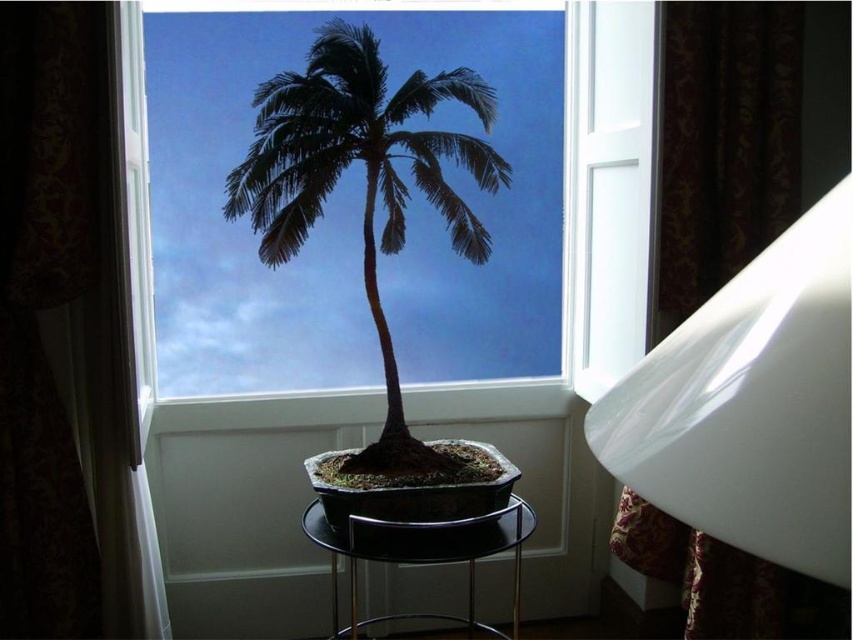
This screenshot has width=853, height=640. What do you see at coordinates (421, 556) in the screenshot?
I see `black glass stool at center` at bounding box center [421, 556].

Which is in front, point (334, 554) or point (352, 480)?

Point (352, 480)

Between point (471, 524) and point (450, 488), which one is positioned behind?

Positioned behind is point (471, 524).

Locate an element on the screen. The width and height of the screenshot is (853, 640). black glass stool at center is located at coordinates coord(421,556).

Between silky black palm tree at center and black glass stool at center, which one appears on the right side from the viewer's perspective?

From the viewer's perspective, black glass stool at center appears more on the right side.

Which is below, silky black palm tree at center or black glass stool at center?

black glass stool at center is lower down.

Is point (322, 58) positioned in front of point (318, 528)?

Yes, point (322, 58) is closer to viewer.

Find the location of `silky black palm tree at center`. silky black palm tree at center is located at coordinates tap(364, 182).

Consider the image. Does silky black palm tree at center appear on the right side of dull brown soil at center?

No, silky black palm tree at center is not to the right of dull brown soil at center.

Who is positioned more to the right, silky black palm tree at center or dull brown soil at center?

dull brown soil at center is more to the right.

Find the location of `silky black palm tree at center`. silky black palm tree at center is located at coordinates (364, 182).